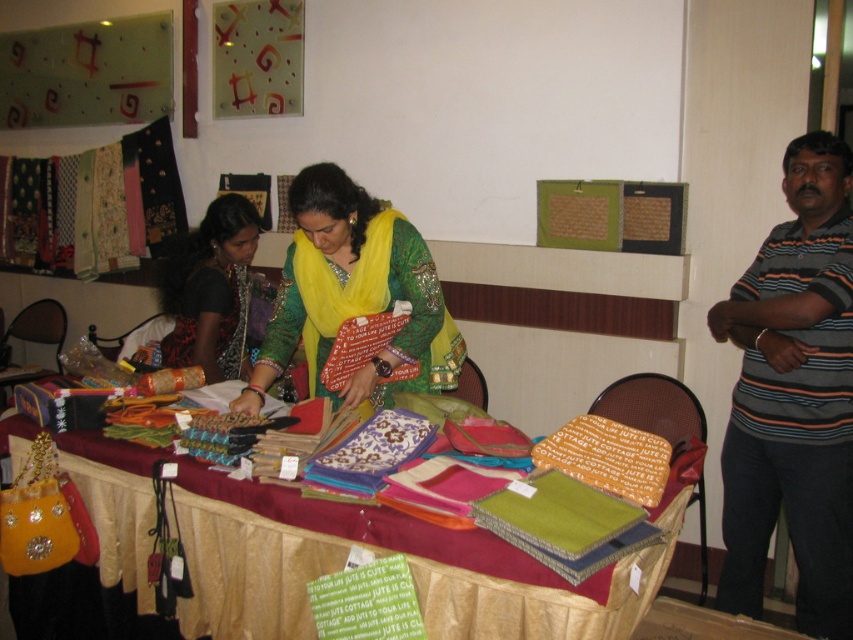
Is matte black blouse at center wider than matte orange fabric at center?

Correct, the width of matte black blouse at center exceeds that of matte orange fabric at center.

You are a GUI agent. You are given a task and a screenshot of the screen. Output one action in this format:
    pyautogui.click(x=<x>, y=<y>)
    Task: Click on the matte black blouse at center
    
    Given the screenshot: What is the action you would take?
    pyautogui.click(x=210, y=289)

Which is behind, point (196, 339) or point (218, 349)?

Point (218, 349)

Locate an element on the screen. matte black blouse at center is located at coordinates (210, 289).

Does black woven fabric at upper left come in front of matte orange fabric at center?

No.

Between point (35, 170) and point (242, 332), which one is positioned in front?

Point (242, 332) is in front.

Locate an element on the screen. black woven fabric at upper left is located at coordinates (91, 205).

Which of these two, textured fabric at center or striped cotton shirt at right, stands taller?

With more height is striped cotton shirt at right.

Does textured fabric at center appear on the left side of striped cotton shirt at right?

Indeed, textured fabric at center is positioned on the left side of striped cotton shirt at right.

Measure the distance between point [381,540] and camera.

They are 1.77 meters apart.

Identify the location of textured fabric at center. (387, 552).